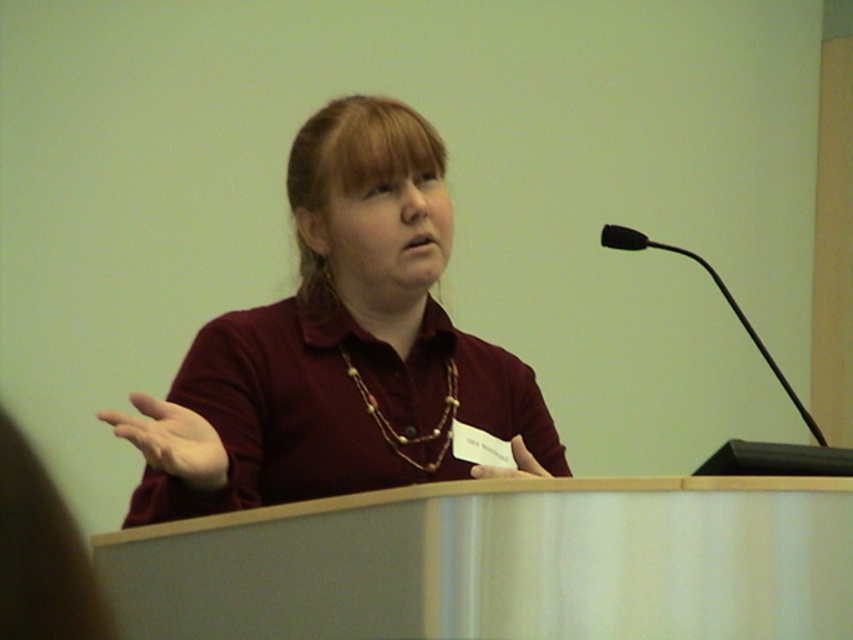
Question: Does maroon fabric shirt at center appear on the right side of brown beaded necklace at center?

Choices:
 (A) no
 (B) yes

Answer: (B)

Question: Is the position of maroon fabric shirt at center less distant than that of brown beaded necklace at center?

Choices:
 (A) yes
 (B) no

Answer: (A)

Question: Does maroon fabric shirt at center lie in front of brown beaded necklace at center?

Choices:
 (A) no
 (B) yes

Answer: (B)